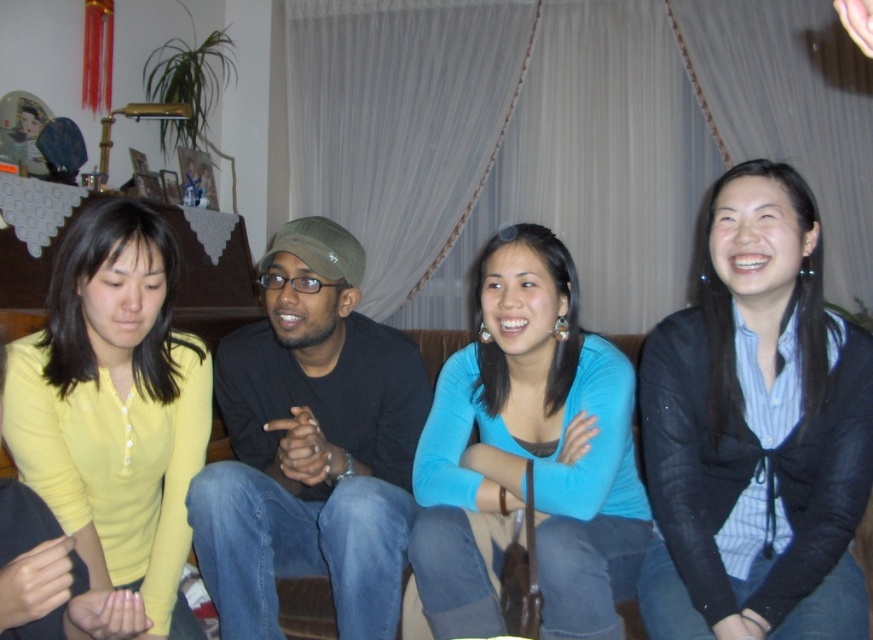
You are standing in the living room and want to place a small plant between the two points, point (737, 451) and point (193, 449). Which point should the plant be closer to in order to be nearer to the viewer?

The plant should be placed closer to point (737, 451) because it is closer to the viewer than point (193, 449).

You are standing in the living room and need to find the matte black jacket at lower right. According to the scene description, where exactly is it positioned?

The matte black jacket at lower right is located at point (755, 432).